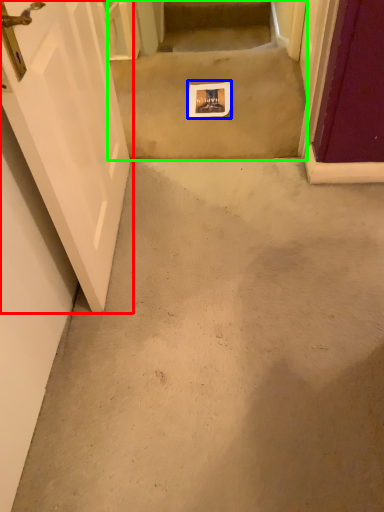
Question: Considering the real-world distances, which object is farthest from door (highlighted by a red box)? postcard (highlighted by a blue box) or stairwell (highlighted by a green box)?

Choices:
 (A) postcard
 (B) stairwell

Answer: (A)